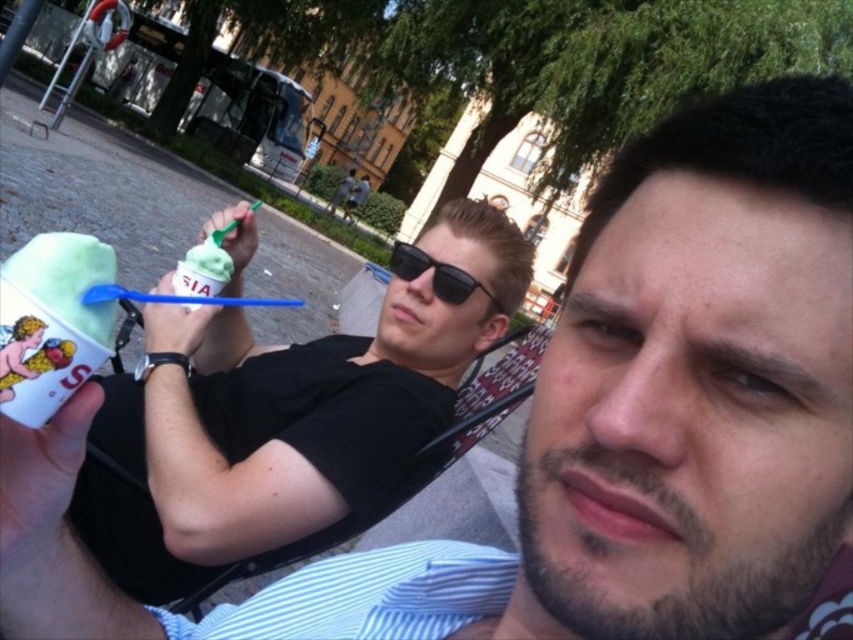
Question: Does green matte ice cream at center have a larger size compared to black plastic sunglasses at center?

Choices:
 (A) no
 (B) yes

Answer: (B)

Question: Which point is closer to the camera?

Choices:
 (A) black plastic sunglasses at center
 (B) green matte ice cream at center

Answer: (B)

Question: From the image, what is the correct spatial relationship of green matte ice cream at center in relation to black plastic sunglasses at center?

Choices:
 (A) below
 (B) above

Answer: (A)

Question: Which of the following is the closest to the observer?

Choices:
 (A) black plastic sunglasses at center
 (B) green matte ice cream at center

Answer: (B)

Question: Which point is closer to the camera taking this photo?

Choices:
 (A) (366, 346)
 (B) (412, 244)

Answer: (B)

Question: Does green matte ice cream at center appear on the left side of black plastic sunglasses at center?

Choices:
 (A) yes
 (B) no

Answer: (A)